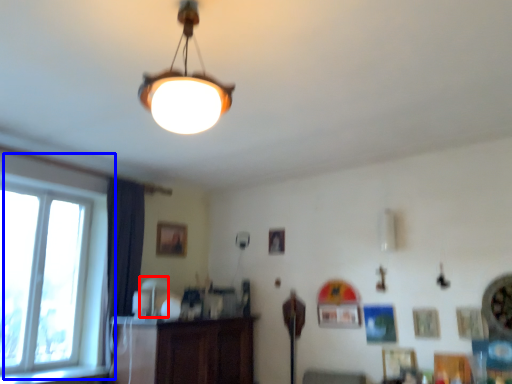
Question: Which object is further to the camera taking this photo, lamp (highlighted by a red box) or window (highlighted by a blue box)?

Choices:
 (A) lamp
 (B) window

Answer: (A)